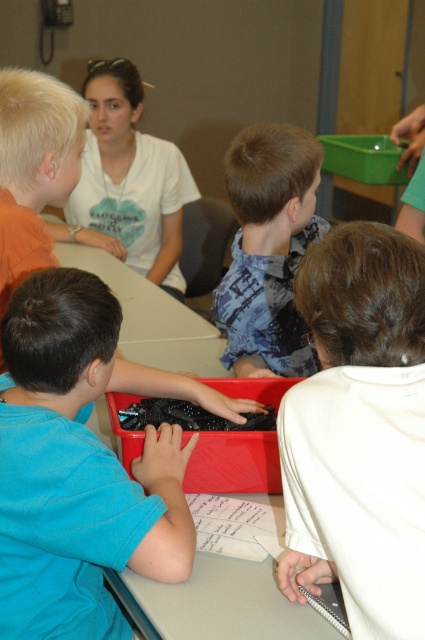
You are a photographer trying to capture a closeup of the blue matte shirt at center without including the white matte shirt at upper center in the frame. Based on their positions, is this possible?

The blue matte shirt at center is in front of the white matte shirt at upper center, so it is possible to capture a closeup of the blue matte shirt at center without including the white matte shirt at upper center in the frame.

Please look at the image and locate the point at coordinates (269, 250). What object is located at this point?

The point at coordinates (269, 250) corresponds to the blue printed shirt at center.